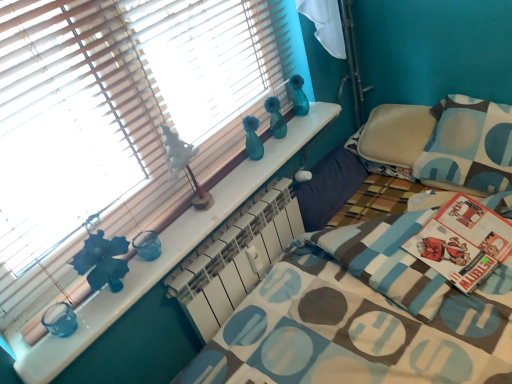
Where is `unoccupied region to the right of white matte table lamp at upper center`? This screenshot has height=384, width=512. unoccupied region to the right of white matte table lamp at upper center is located at coordinates 239,184.